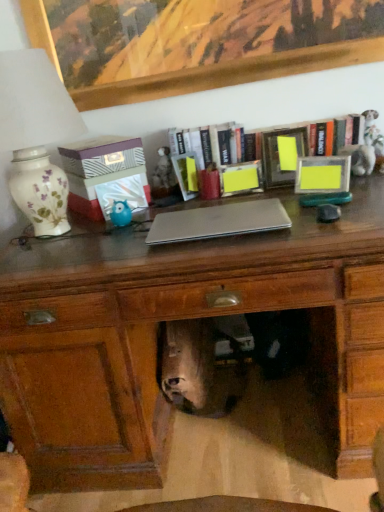
The width and height of the screenshot is (384, 512). What are the coordinates of `free space to the left of matte blue plastic owl at center-left` in the screenshot? It's located at (77, 232).